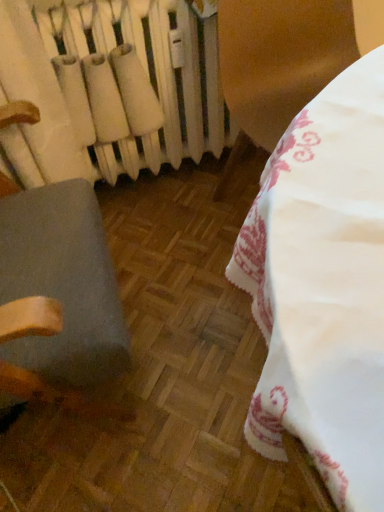
Locate an element on the screen. This screenshot has width=384, height=512. free space to the right of gray fabric chair at left is located at coordinates (196, 335).